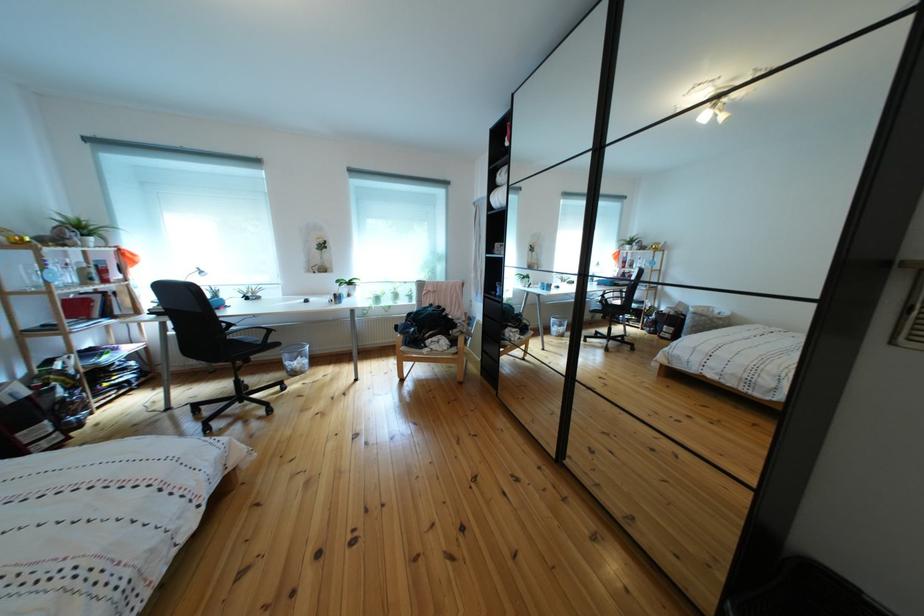
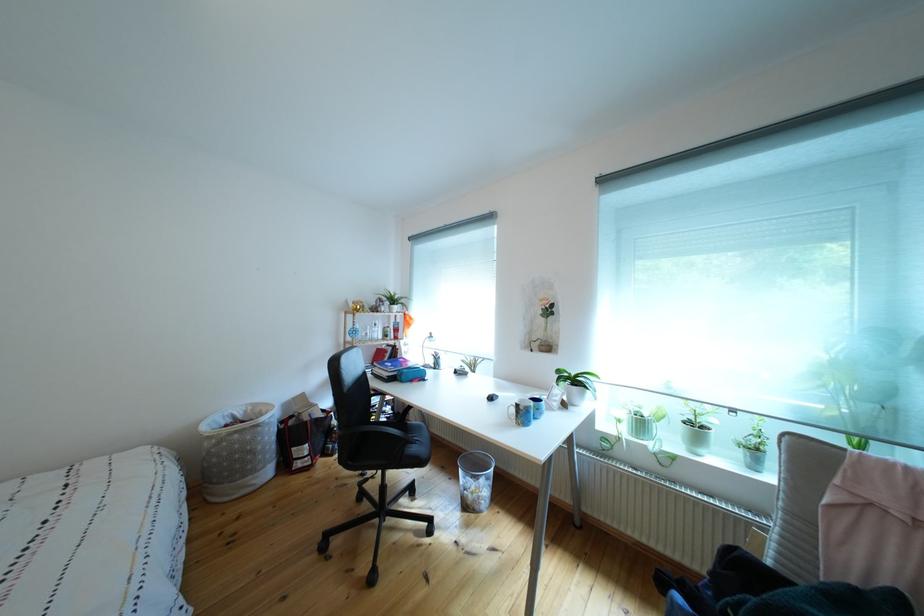
The point at [388,304] is marked in the first image. Where is the corresponding point in the second image?

(652, 430)